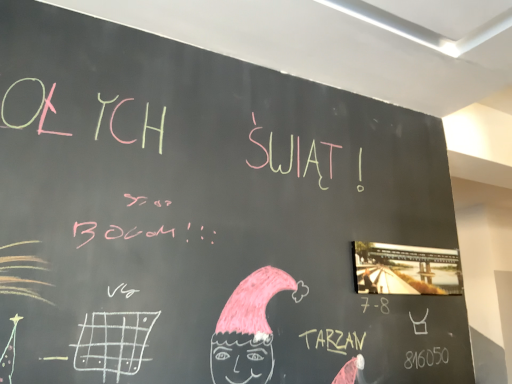
This screenshot has height=384, width=512. Describe the element at coordinates (406, 269) in the screenshot. I see `metallic silver poster at upper right` at that location.

This screenshot has height=384, width=512. What are the coordinates of `metallic silver poster at upper right` in the screenshot? It's located at (406, 269).

This screenshot has height=384, width=512. In order to click on metallic silver poster at upper right in this screenshot , I will do `click(406, 269)`.